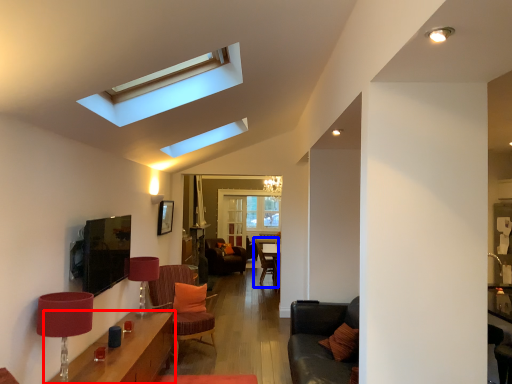
Question: Which point is closer to the camera, table (highlighted by a red box) or armchair (highlighted by a blue box)?

Choices:
 (A) table
 (B) armchair

Answer: (A)